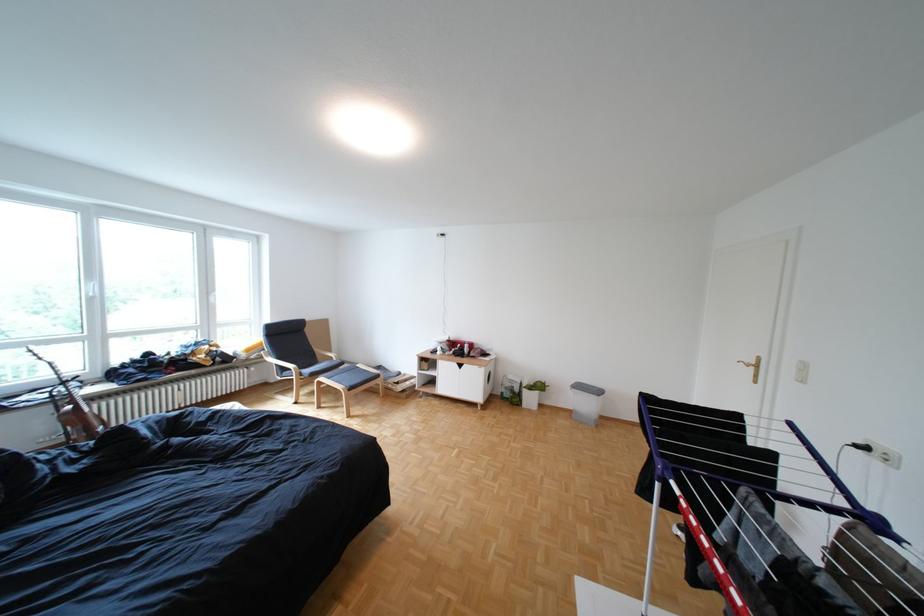
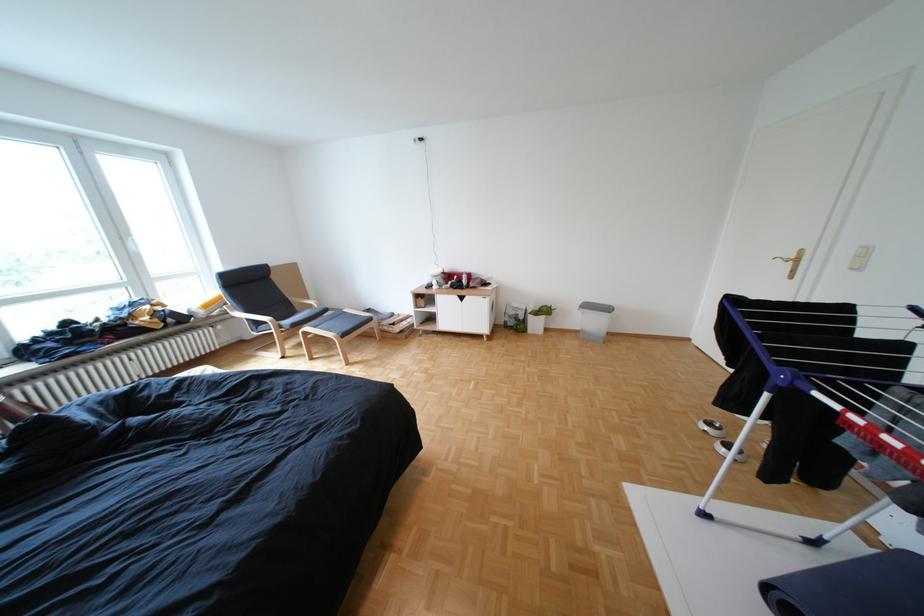
Where in the second image is the point corresponding to (x=337, y=379) from the first image?

(322, 329)